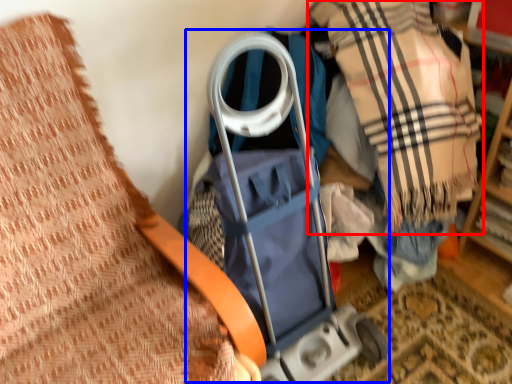
Question: Which object is closer to the camera taking this photo, plaid (highlighted by a red box) or baby carriage (highlighted by a blue box)?

Choices:
 (A) plaid
 (B) baby carriage

Answer: (A)